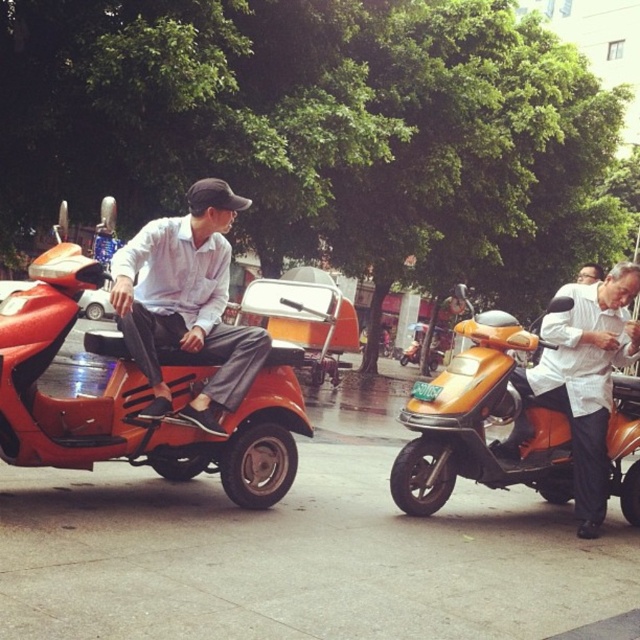
You are standing at the point marked as point (588, 417) in the image. A drone needs to deliver a package to you. The drone can only fly up to 5 meters. Will the drone be able to reach you?

The distance of point (588, 417) from viewer is 5.99 meters, so the drone cannot reach you as it exceeds the 5 meters limit.

You are designing a safety poster for scooter riders and need to include both the orange matte scooter at left and the matte white shirt at center. Since space is limited, you must ensure the scooter is clearly visible. Which object should be enlarged more to maintain visibility, and why?

The orange matte scooter at left should be enlarged more because it is already larger in size than the matte white shirt at center, making it easier to emphasize its visibility in the safety poster.